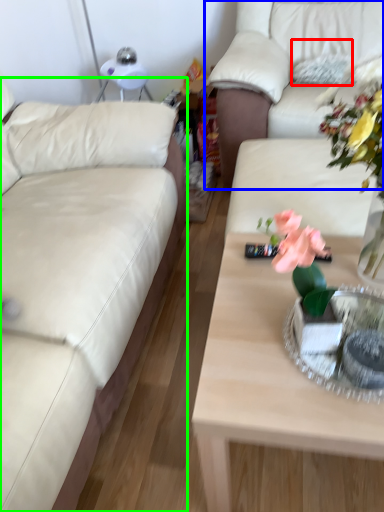
Question: Which is farther away from pillow (highlighted by a red box)? studio couch (highlighted by a blue box) or studio couch (highlighted by a green box)?

Choices:
 (A) studio couch
 (B) studio couch

Answer: (B)